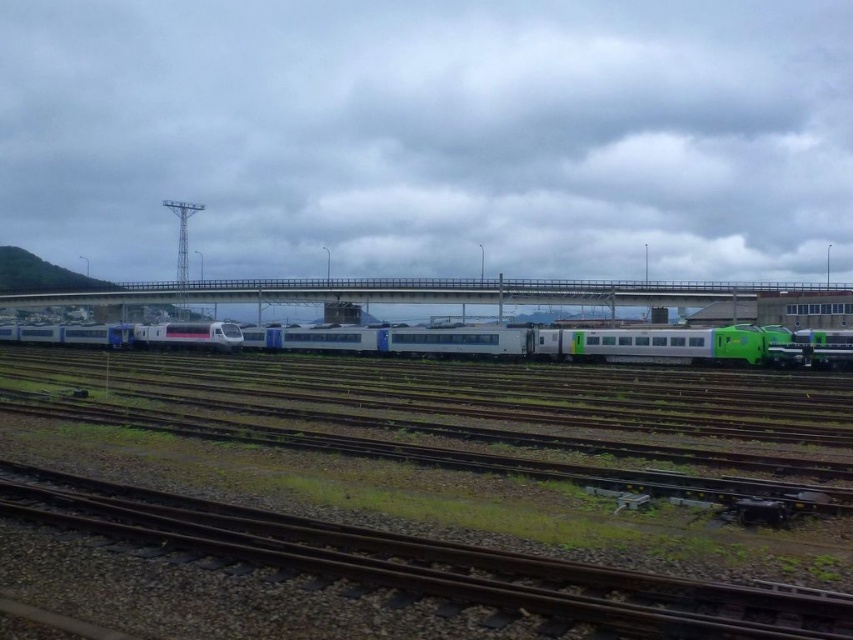
You are a train conductor who needs to board the white glossy train at center. There is a concrete bridge at center nearby. Which direction should you walk from the bridge to reach the train?

You should walk to the left from the concrete bridge at center to reach the white glossy train at center, since the train is positioned to the left of the bridge.